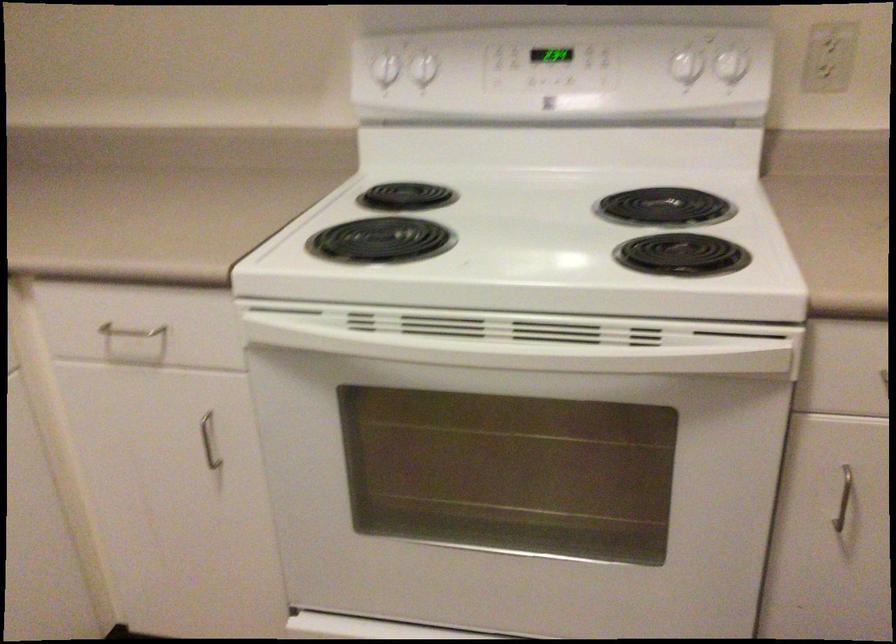
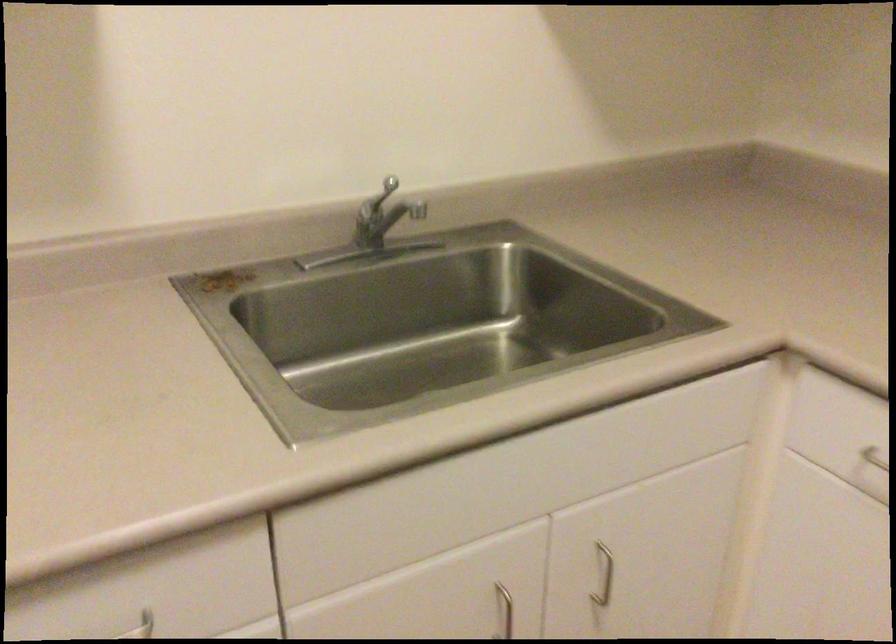
Question: The camera is either moving clockwise (left) or counter-clockwise (right) around the object. The first image is from the beginning of the video and the second image is from the end. Is the camera moving left or right when shooting the video?

Choices:
 (A) Left
 (B) Right

Answer: (B)